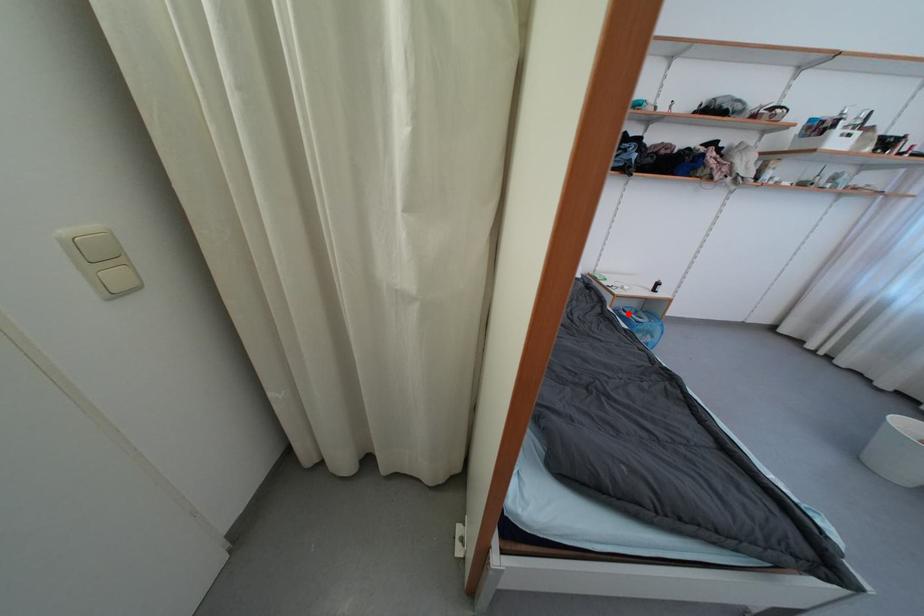
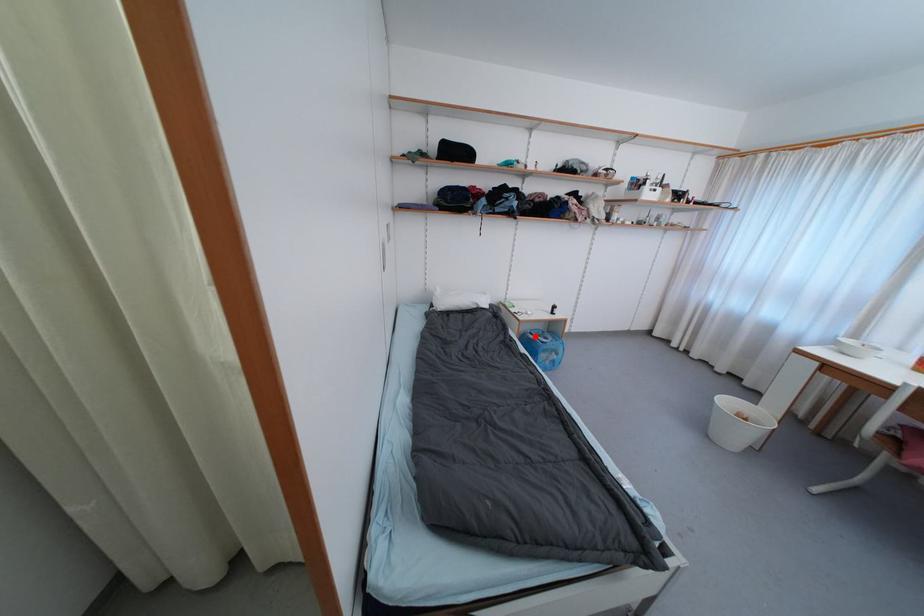
I am providing you with two images of the same scene from different viewpoints. A red point is marked on the first image and another point is marked on the second image. Is the marked point in image1 the same physical position as the marked point in image2?

Yes